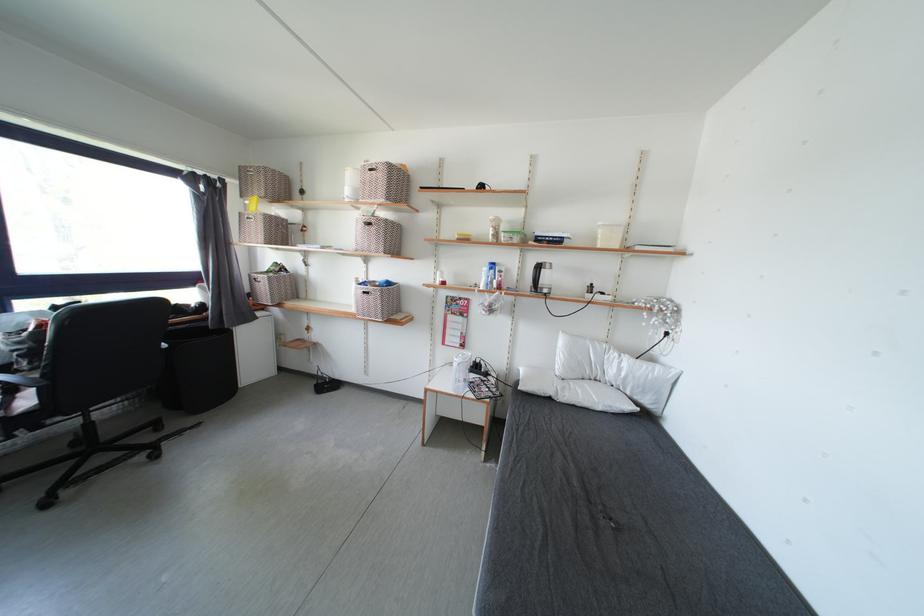
Find where to lift the white pillow. Please return your answer as a coordinate pair (x, y).

(579, 358)